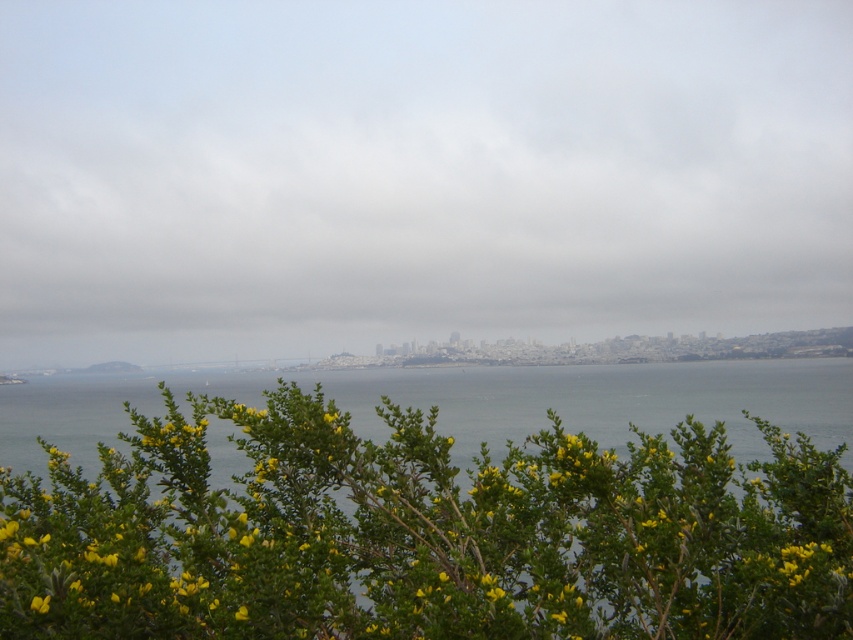
Can you confirm if transparent water at center is positioned below green leafy bush at lower center?

Incorrect, transparent water at center is not positioned below green leafy bush at lower center.

Is transparent water at center to the left of green leafy bush at lower center from the viewer's perspective?

Incorrect, transparent water at center is not on the left side of green leafy bush at lower center.

This screenshot has width=853, height=640. What do you see at coordinates (416, 173) in the screenshot? I see `transparent water at center` at bounding box center [416, 173].

The width and height of the screenshot is (853, 640). In order to click on transparent water at center in this screenshot , I will do [x=416, y=173].